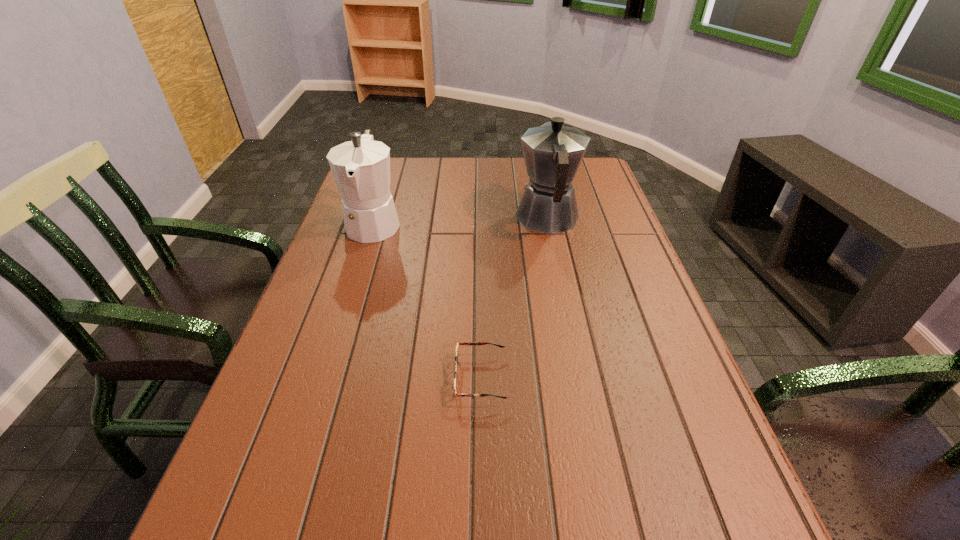
This screenshot has height=540, width=960. Identify the location of vacant region between the rightmost object and the leftmost object. 461,221.

Image resolution: width=960 pixels, height=540 pixels. What are the coordinates of `free space between the second object from right to left and the right coffeepot` in the screenshot? It's located at [x=514, y=298].

What are the coordinates of `free space between the spectacles and the left coffeepot` in the screenshot? It's located at (427, 300).

Locate an element on the screen. free space between the spectacles and the right coffeepot is located at coordinates (514, 298).

Locate an element on the screen. This screenshot has height=540, width=960. free spot between the spectacles and the right coffeepot is located at coordinates (514, 298).

You are a GUI agent. You are given a task and a screenshot of the screen. Output one action in this format:
    pyautogui.click(x=<x>, y=<y>)
    Task: Click on the free spot between the nearest object and the right coffeepot
    The height and width of the screenshot is (540, 960).
    Given the screenshot: What is the action you would take?
    pyautogui.click(x=514, y=298)

Where is `free spot between the rightmost object and the shortest object`? free spot between the rightmost object and the shortest object is located at coordinates (514, 298).

Where is `vacant region between the right coffeepot and the spectacles`? The image size is (960, 540). vacant region between the right coffeepot and the spectacles is located at coordinates (514, 298).

Identify which object is the second nearest to the rightmost object. Please provide its 2D coordinates. Your answer should be formatted as a tuple, i.e. [(x, y)], where the tuple contains the x and y coordinates of a point satisfying the conditions above.

[(461, 343)]

You are a GUI agent. You are given a task and a screenshot of the screen. Output one action in this format:
    pyautogui.click(x=<x>, y=<y>)
    Task: Click on the object that is the closest one to the nearest object
    
    Given the screenshot: What is the action you would take?
    pyautogui.click(x=552, y=152)